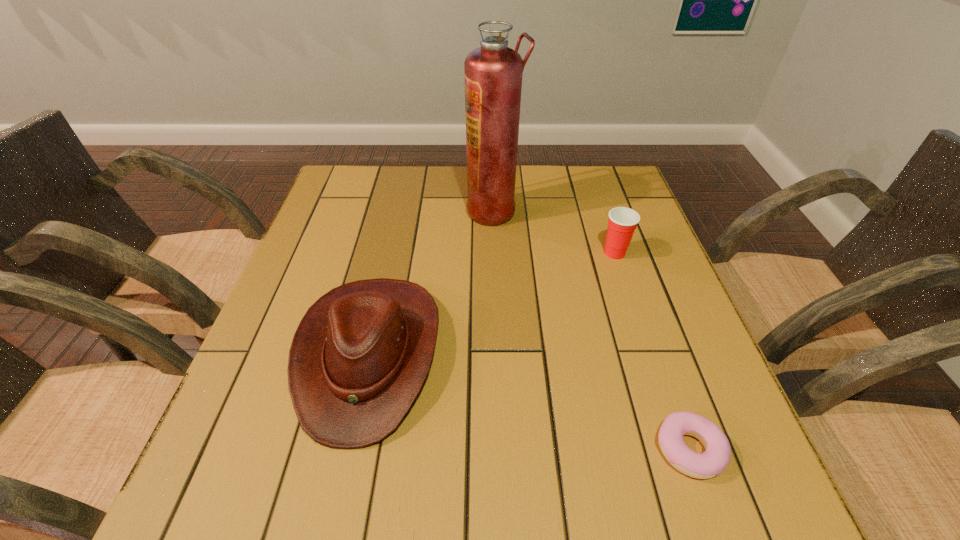
The height and width of the screenshot is (540, 960). I want to click on vacant space located 0.310m on the back of the shortest object, so click(635, 293).

Where is `object that is at the far edge`? object that is at the far edge is located at coordinates (493, 72).

Identify the location of object positioned at the near edge. (714, 460).

Find the location of a particular element. Image resolution: width=960 pixels, height=540 pixels. object present at the left edge is located at coordinates (360, 355).

Where is `Dixie cup at the right edge`? This screenshot has width=960, height=540. Dixie cup at the right edge is located at coordinates (622, 222).

The height and width of the screenshot is (540, 960). What are the coordinates of `pastry present at the right edge` in the screenshot? It's located at (714, 460).

Find the location of `object that is at the near right corner`. object that is at the near right corner is located at coordinates (714, 460).

Locate an element on the screen. Image resolution: width=960 pixels, height=540 pixels. vacant area at the far edge is located at coordinates (392, 197).

Identify the location of blank area at the near edge. This screenshot has width=960, height=540. (601, 495).

Locate an element on the screen. free space at the left edge of the desktop is located at coordinates (246, 386).